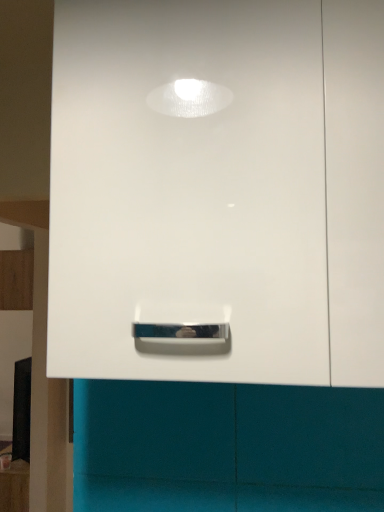
This screenshot has height=512, width=384. In order to click on white glossy cabinet handle at center in this screenshot , I will do `click(218, 191)`.

What do you see at coordinates (218, 191) in the screenshot? I see `white glossy cabinet handle at center` at bounding box center [218, 191].

At what (x,y) coordinates should I click in order to perform the action: click on white glossy cabinet handle at center. Please return your answer as a coordinate pair (x, y). Looking at the image, I should click on (218, 191).